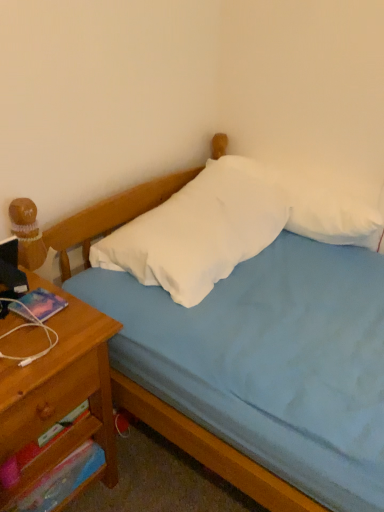
What do you see at coordinates (256, 367) in the screenshot?
I see `light blue fabric bed at center` at bounding box center [256, 367].

Identify the location of wooden nightstand at left. Image resolution: width=384 pixels, height=512 pixels. (60, 393).

This screenshot has width=384, height=512. What do you see at coordinates (60, 393) in the screenshot? I see `wooden nightstand at left` at bounding box center [60, 393].

This screenshot has height=512, width=384. I want to click on white soft pillow at upper right, the 1th pillow when ordered from right to left, so click(x=324, y=204).

Describe the element at coordinates (199, 231) in the screenshot. I see `white soft pillow at center, the 1th pillow viewed from the left` at that location.

This screenshot has height=512, width=384. What do you see at coordinates (50, 458) in the screenshot?
I see `wooden drawer at lower left, which is the second drawer in top-to-bottom order` at bounding box center [50, 458].

Describe the element at coordinates (48, 403) in the screenshot. This screenshot has height=512, width=384. I see `wooden drawer at left, the second drawer when ordered from bottom to top` at that location.

I want to click on light blue fabric bed at center, so click(256, 367).

Looking at this image, is light blue fabric bed at center next to wooden nightstand at left and touching it?

light blue fabric bed at center and wooden nightstand at left are clearly separated.

Does light blue fabric bed at center have a lesser width compared to wooden nightstand at left?

No, light blue fabric bed at center is not thinner than wooden nightstand at left.

Measure the distance from light blue fabric bed at center to wooden nightstand at left.

They are 33.33 centimeters apart.

Can you confirm if light blue fabric bed at center is bigger than wooden nightstand at left?

Yes, light blue fabric bed at center is bigger than wooden nightstand at left.

In the scene shown: Considering the sizes of wooden drawer at lower left, acting as the first drawer starting from the bottom, and wooden drawer at left, acting as the first drawer starting from the top, in the image, is wooden drawer at lower left, acting as the first drawer starting from the bottom, taller or shorter than wooden drawer at left, acting as the first drawer starting from the top,?

In the image, wooden drawer at lower left, acting as the first drawer starting from the bottom, appears to be taller than wooden drawer at left, acting as the first drawer starting from the top.

Is wooden drawer at lower left, which is the second drawer in top-to-bottom order, wider or thinner than wooden drawer at left, the second drawer when ordered from bottom to top?

Clearly, wooden drawer at lower left, which is the second drawer in top-to-bottom order, has less width compared to wooden drawer at left, the second drawer when ordered from bottom to top.

Does point (70, 435) come behind point (5, 425)?

Yes, it is.

From the image's perspective, which is above, wooden drawer at lower left, which is the second drawer in top-to-bottom order, or wooden drawer at left, the second drawer when ordered from bottom to top?

wooden drawer at left, the second drawer when ordered from bottom to top, from the image's perspective.

Which point is more distant from viewer, (112,234) or (236,348)?

Positioned behind is point (112,234).

From the image's perspective, is white soft pillow at center, the 1th pillow viewed from the left, above light blue fabric bed at center?

Correct, white soft pillow at center, the 1th pillow viewed from the left, appears higher than light blue fabric bed at center in the image.

Is white soft pillow at center, which is the second pillow from right to left, thinner than light blue fabric bed at center?

Yes.

Between white soft pillow at upper right, the 1th pillow when ordered from right to left, and wooden drawer at lower left, acting as the first drawer starting from the bottom, which one has less height?

With less height is wooden drawer at lower left, acting as the first drawer starting from the bottom.

Which is in front, point (305, 179) or point (64, 440)?

The point (64, 440) is closer.

Between white soft pillow at upper right, the 1th pillow when ordered from right to left, and wooden drawer at lower left, which is the second drawer in top-to-bottom order, which one appears on the left side from the viewer's perspective?

wooden drawer at lower left, which is the second drawer in top-to-bottom order.

From a real-world perspective, which object stands above the other?

white soft pillow at upper right, the 1th pillow when ordered from right to left.

From a real-world perspective, is wooden drawer at lower left, acting as the first drawer starting from the bottom, positioned above or below light blue fabric bed at center?

Clearly, from a real-world perspective, wooden drawer at lower left, acting as the first drawer starting from the bottom, is below light blue fabric bed at center.

Does point (53, 445) come behind point (359, 338)?

No, it is in front of (359, 338).

Which is correct: wooden drawer at lower left, which is the second drawer in top-to-bottom order, is inside light blue fabric bed at center, or outside of it?

wooden drawer at lower left, which is the second drawer in top-to-bottom order, exists outside the volume of light blue fabric bed at center.

Considering the relative positions of wooden drawer at lower left, which is the second drawer in top-to-bottom order, and wooden nightstand at left in the image provided, is wooden drawer at lower left, which is the second drawer in top-to-bottom order, to the left or to the right of wooden nightstand at left?

In the image, wooden drawer at lower left, which is the second drawer in top-to-bottom order, appears on the right side of wooden nightstand at left.

Which drawer is the 2nd one when counting from the right side of the wooden nightstand at left? Please provide its 2D coordinates.

[(50, 458)]

Does point (11, 490) appear closer or farther from the camera than point (103, 382)?

Point (11, 490) appears to be closer to the viewer than point (103, 382).

Between wooden drawer at lower left, acting as the first drawer starting from the bottom, and wooden nightstand at left, which one has larger width?

Wider between the two is wooden nightstand at left.

Between white soft pillow at upper right, the 1th pillow when ordered from right to left, and wooden drawer at left, acting as the first drawer starting from the top, which one is positioned in front?

wooden drawer at left, acting as the first drawer starting from the top, is more forward.

Is white soft pillow at upper right, acting as the 2th pillow starting from the left, located outside wooden drawer at left, the second drawer when ordered from bottom to top?

white soft pillow at upper right, acting as the 2th pillow starting from the left, lies outside wooden drawer at left, the second drawer when ordered from bottom to top,'s area.

From a real-world perspective, is white soft pillow at upper right, acting as the 2th pillow starting from the left, above or below wooden drawer at left, the second drawer when ordered from bottom to top?

In terms of real-world spatial position, white soft pillow at upper right, acting as the 2th pillow starting from the left, is above wooden drawer at left, the second drawer when ordered from bottom to top.

Locate an element on the screen. The height and width of the screenshot is (512, 384). bed lying on the right of wooden nightstand at left is located at coordinates (256, 367).

Where is `drawer above the wooden drawer at lower left, acting as the first drawer starting from the bottom (from a real-world perspective)`? The width and height of the screenshot is (384, 512). drawer above the wooden drawer at lower left, acting as the first drawer starting from the bottom (from a real-world perspective) is located at coordinates (48, 403).

Considering their positions, is wooden nightstand at left positioned closer to wooden drawer at left, acting as the first drawer starting from the top, than light blue fabric bed at center?

wooden nightstand at left is closer to wooden drawer at left, acting as the first drawer starting from the top.

From the image, which object appears to be farther from wooden nightstand at left, white soft pillow at center, which is the second pillow from right to left, or white soft pillow at upper right, the 1th pillow when ordered from right to left?

white soft pillow at upper right, the 1th pillow when ordered from right to left, lies further to wooden nightstand at left than the other object.

From the image, which object appears to be nearer to wooden drawer at left, acting as the first drawer starting from the top, wooden nightstand at left or white soft pillow at upper right, acting as the 2th pillow starting from the left?

Among the two, wooden nightstand at left is located nearer to wooden drawer at left, acting as the first drawer starting from the top.

Which object lies nearer to the anchor point light blue fabric bed at center, wooden nightstand at left or white soft pillow at center, the 1th pillow viewed from the left?

Among the two, white soft pillow at center, the 1th pillow viewed from the left, is located nearer to light blue fabric bed at center.

Considering their positions, is light blue fabric bed at center positioned closer to white soft pillow at center, which is the second pillow from right to left, than wooden drawer at lower left, which is the second drawer in top-to-bottom order?

Among the two, light blue fabric bed at center is located nearer to white soft pillow at center, which is the second pillow from right to left.

When comparing their distances from white soft pillow at center, the 1th pillow viewed from the left, does wooden drawer at left, acting as the first drawer starting from the top, or wooden nightstand at left seem further?

The object further to white soft pillow at center, the 1th pillow viewed from the left, is wooden drawer at left, acting as the first drawer starting from the top.

Looking at this image, which object lies further to the anchor point white soft pillow at center, which is the second pillow from right to left, wooden drawer at left, the second drawer when ordered from bottom to top, or white soft pillow at upper right, the 1th pillow when ordered from right to left?

wooden drawer at left, the second drawer when ordered from bottom to top, lies further to white soft pillow at center, which is the second pillow from right to left, than the other object.

Looking at the image, which one is located closer to wooden drawer at lower left, acting as the first drawer starting from the bottom, wooden drawer at left, the second drawer when ordered from bottom to top, or light blue fabric bed at center?

Based on the image, wooden drawer at left, the second drawer when ordered from bottom to top, appears to be nearer to wooden drawer at lower left, acting as the first drawer starting from the bottom.

Locate an element on the screen. This screenshot has width=384, height=512. bed that lies between white soft pillow at center, which is the second pillow from right to left, and wooden drawer at lower left, acting as the first drawer starting from the bottom, from top to bottom is located at coordinates (256, 367).

Where is `pillow between wooden nightstand at left and white soft pillow at upper right, the 1th pillow when ordered from right to left`? pillow between wooden nightstand at left and white soft pillow at upper right, the 1th pillow when ordered from right to left is located at coordinates (199, 231).

Where is `pillow between white soft pillow at upper right, the 1th pillow when ordered from right to left, and wooden drawer at lower left, which is the second drawer in top-to-bottom order, vertically`? The width and height of the screenshot is (384, 512). pillow between white soft pillow at upper right, the 1th pillow when ordered from right to left, and wooden drawer at lower left, which is the second drawer in top-to-bottom order, vertically is located at coordinates (199, 231).

At what (x,y) coordinates should I click in order to perform the action: click on drawer between white soft pillow at center, the 1th pillow viewed from the left, and wooden drawer at lower left, which is the second drawer in top-to-bottom order, from top to bottom. Please return your answer as a coordinate pair (x, y). The height and width of the screenshot is (512, 384). Looking at the image, I should click on (48, 403).